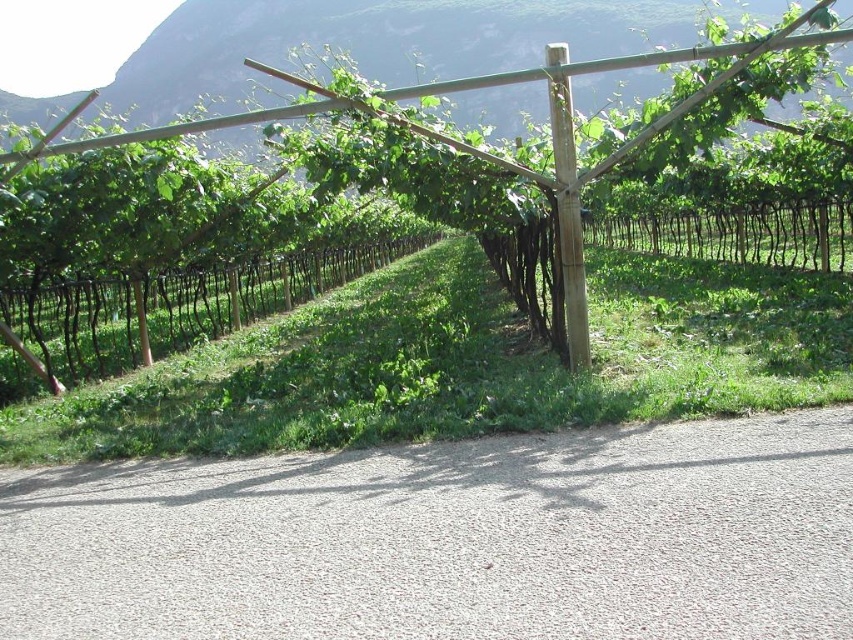
You are a vineyard worker checking the structural integrity of the green bamboo fence at center and the brown wood pole at center. Which one requires more material to construct based on their sizes?

The green bamboo fence at center has a larger size compared to the brown wood pole at center, so it requires more material to construct.

You are a gardener standing at the entrance of the vineyard. You need to check the stability of both the green bamboo fence at center and the brown wood pole at center. Which object is positioned higher relative to the other?

The green bamboo fence at center is positioned higher than the brown wood pole at center.